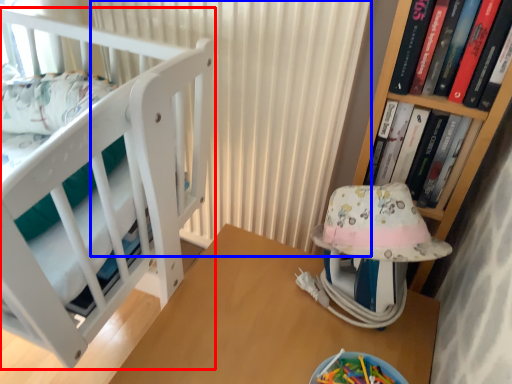
Question: Which object appears farthest to the camera in this image, furniture (highlighted by a red box) or curtain (highlighted by a blue box)?

Choices:
 (A) furniture
 (B) curtain

Answer: (B)